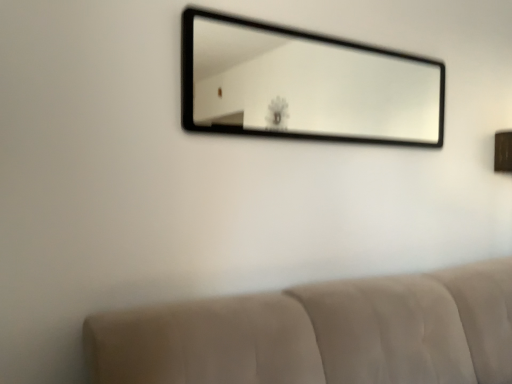
Locate an element on the screen. The width and height of the screenshot is (512, 384). black glass mirror at upper center is located at coordinates (312, 86).

Describe the element at coordinates (312, 86) in the screenshot. The image size is (512, 384). I see `black glass mirror at upper center` at that location.

You are a GUI agent. You are given a task and a screenshot of the screen. Output one action in this format:
    pyautogui.click(x=<x>, y=<y>)
    Task: Click on the beige fabric couch at lower center
    Image resolution: width=512 pixels, height=384 pixels.
    Given the screenshot: What is the action you would take?
    pyautogui.click(x=320, y=333)

Measure the distance between point (297, 318) and camera.

The distance of point (297, 318) from camera is 4.80 feet.

This screenshot has width=512, height=384. What do you see at coordinates (320, 333) in the screenshot?
I see `beige fabric couch at lower center` at bounding box center [320, 333].

Where is `black glass mirror at upper center`? This screenshot has height=384, width=512. black glass mirror at upper center is located at coordinates (312, 86).

Based on the photo, is black glass mirror at upper center to the left of beige fabric couch at lower center from the viewer's perspective?

In fact, black glass mirror at upper center is to the right of beige fabric couch at lower center.

Relative to beige fabric couch at lower center, is black glass mirror at upper center in front or behind?

Visually, black glass mirror at upper center is located behind beige fabric couch at lower center.

Which is behind, point (309, 87) or point (393, 380)?

The point (309, 87) is more distant.

From the image's perspective, is black glass mirror at upper center beneath beige fabric couch at lower center?

No, from the image's perspective, black glass mirror at upper center is not below beige fabric couch at lower center.

From a real-world perspective, is black glass mirror at upper center on beige fabric couch at lower center?

Yes, from a real-world perspective, black glass mirror at upper center is over beige fabric couch at lower center

Which of these two, black glass mirror at upper center or beige fabric couch at lower center, is thinner?

black glass mirror at upper center is thinner.

Is black glass mirror at upper center taller than beige fabric couch at lower center?

Incorrect, the height of black glass mirror at upper center is not larger of that of beige fabric couch at lower center.

Which of these two, black glass mirror at upper center or beige fabric couch at lower center, is bigger?

beige fabric couch at lower center.

Can beige fabric couch at lower center be found inside black glass mirror at upper center?

No, beige fabric couch at lower center is not a part of black glass mirror at upper center.

Would you say black glass mirror at upper center is a long distance from beige fabric couch at lower center?

Yes, black glass mirror at upper center is far from beige fabric couch at lower center.

Could you tell me if black glass mirror at upper center is facing beige fabric couch at lower center?

No, black glass mirror at upper center is not facing towards beige fabric couch at lower center.

How different are the orientations of black glass mirror at upper center and beige fabric couch at lower center in degrees?

There is a 3.13-degree angle between the facing directions of black glass mirror at upper center and beige fabric couch at lower center.

Measure the distance between black glass mirror at upper center and beige fabric couch at lower center.

A distance of 2.76 meters exists between black glass mirror at upper center and beige fabric couch at lower center.

I want to click on furniture below the black glass mirror at upper center (from the image's perspective), so click(x=320, y=333).

Considering the relative positions of beige fabric couch at lower center and black glass mirror at upper center in the image provided, is beige fabric couch at lower center to the left of black glass mirror at upper center from the viewer's perspective?

Indeed, beige fabric couch at lower center is positioned on the left side of black glass mirror at upper center.

Is the depth of beige fabric couch at lower center less than that of black glass mirror at upper center?

Yes, the depth of beige fabric couch at lower center is less than that of black glass mirror at upper center.

Is point (364, 367) closer or farther from the camera than point (264, 109)?

Point (364, 367) is positioned closer to the camera compared to point (264, 109).

From the image's perspective, is beige fabric couch at lower center under black glass mirror at upper center?

Yes, from the image's perspective, beige fabric couch at lower center is beneath black glass mirror at upper center.

From a real-world perspective, who is located lower, beige fabric couch at lower center or black glass mirror at upper center?

beige fabric couch at lower center is physically lower.

Between beige fabric couch at lower center and black glass mirror at upper center, which one has smaller width?

Thinner between the two is black glass mirror at upper center.

Does beige fabric couch at lower center have a greater height compared to black glass mirror at upper center?

Correct, beige fabric couch at lower center is much taller as black glass mirror at upper center.

Between beige fabric couch at lower center and black glass mirror at upper center, which one has smaller size?

black glass mirror at upper center is smaller.

Is black glass mirror at upper center a part of beige fabric couch at lower center?

No, beige fabric couch at lower center does not contain black glass mirror at upper center.

Is beige fabric couch at lower center next to black glass mirror at upper center?

No, beige fabric couch at lower center is not beside black glass mirror at upper center.

Is black glass mirror at upper center at the back of beige fabric couch at lower center?

That's not correct — beige fabric couch at lower center is not looking away from black glass mirror at upper center.

What's the angular difference between beige fabric couch at lower center and black glass mirror at upper center's facing directions?

3.13 degrees.

You are a GUI agent. You are given a task and a screenshot of the screen. Output one action in this format:
    pyautogui.click(x=<x>, y=<y>)
    Task: Click on the mirror positioned vertically above the beige fabric couch at lower center (from a real-world perspective)
    
    Given the screenshot: What is the action you would take?
    pyautogui.click(x=312, y=86)

I want to click on mirror behind the beige fabric couch at lower center, so click(312, 86).

Where is `furniture located below the black glass mirror at upper center (from the image's perspective)`? furniture located below the black glass mirror at upper center (from the image's perspective) is located at coordinates (320, 333).